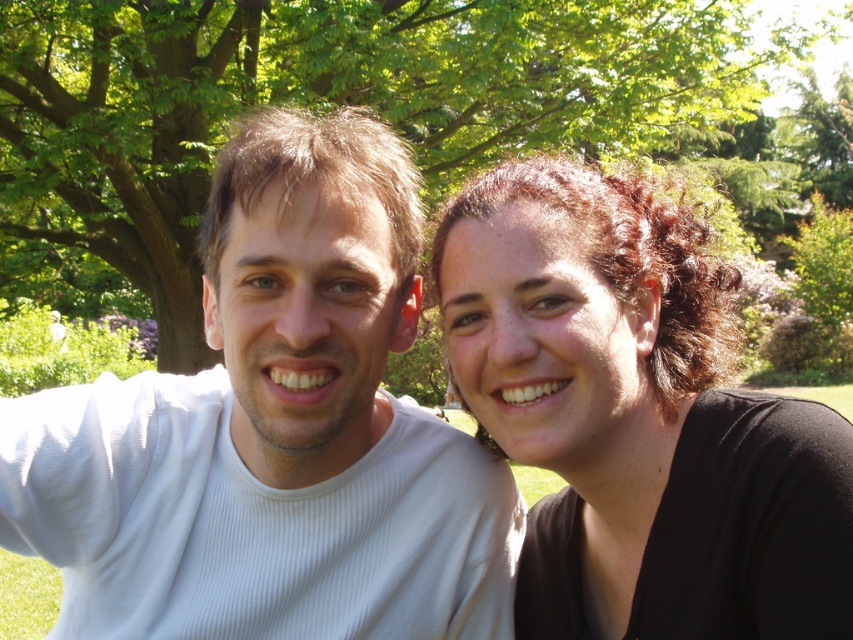
You are standing in a park and want to take a photo of the matte black hair at right. Your camera has a minimum focusing distance of 1.5 meters. Can you take a clear photo without moving closer?

The distance between you and the matte black hair at right is 1.20 meters, which is less than the camera minimum focusing distance of 1.5 meters. Therefore, you cannot take a clear photo without moving closer.

You are standing at point (86, 4) and want to walk to point (287, 412). Based on the scene description, will you have to walk towards or away from the two people in the image?

You will have to walk towards the two people in the image because point (287, 412) is in front of point (86, 4).

You are a photographer trying to capture a group photo of the two people in the scene. To ensure both subjects are in frame, should you position yourself to the left or right side of the white ribbed shirt at left and matte black hair at right?

Since the white ribbed shirt at left is to the left of matte black hair at right, you should position yourself to the right side of the white ribbed shirt at left and matte black hair at right to ensure both subjects are in frame.